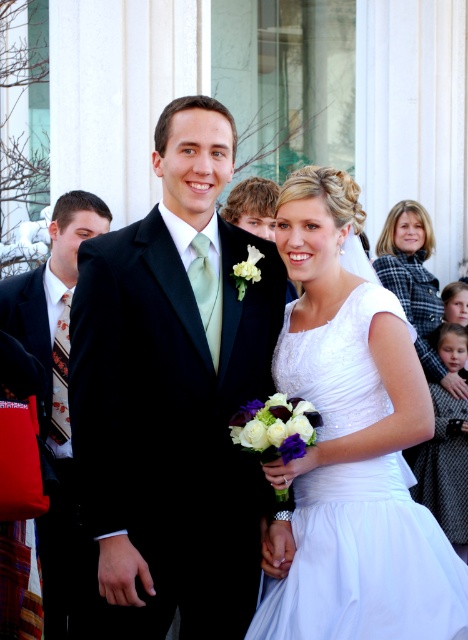
Question: Which object is positioned farthest from the white satin dress at center?

Choices:
 (A) matte black suit at left
 (B) white satin dress at right

Answer: (B)

Question: Is matte black suit at center further to camera compared to white satin dress at center?

Choices:
 (A) yes
 (B) no

Answer: (A)

Question: Is matte black suit at left thinner than white satin dress at right?

Choices:
 (A) yes
 (B) no

Answer: (B)

Question: Estimate the real-world distances between objects in this image. Which object is closer to the matte black suit at left?

Choices:
 (A) matte black suit at center
 (B) white satin dress at center

Answer: (A)

Question: Which of the following is the closest to the observer?

Choices:
 (A) (403, 516)
 (B) (446, 369)

Answer: (A)

Question: Does matte black suit at center appear under white satin dress at center?

Choices:
 (A) yes
 (B) no

Answer: (B)